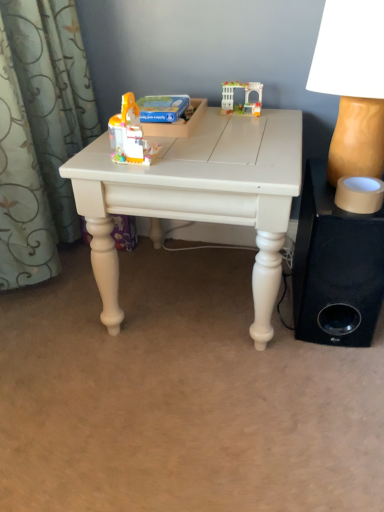
Question: In terms of height, does translucent plastic toy at center, which is counted as the 2th toy, starting from the top, look taller or shorter compared to black fabric speaker at lower right?

Choices:
 (A) short
 (B) tall

Answer: (A)

Question: From a real-world perspective, is translucent plastic toy at center, which is counted as the 2th toy, starting from the top, physically located above or below black fabric speaker at lower right?

Choices:
 (A) below
 (B) above

Answer: (B)

Question: Based on their relative distances, which object is farther from the matte beige lampshade at right?

Choices:
 (A) white matte table at center
 (B) white plastic toy at upper center, acting as the 1th toy starting from the right
 (C) translucent plastic toy at center, which is the 1th toy in left-to-right order
 (D) black fabric speaker at lower right

Answer: (C)

Question: Estimate the real-world distances between objects in this image. Which object is closer to the white plastic toy at upper center, arranged as the 1th toy when viewed from the back?

Choices:
 (A) white matte table at center
 (B) translucent plastic toy at center, the 1th toy in the bottom-to-top sequence
 (C) matte beige lampshade at right
 (D) black fabric speaker at lower right

Answer: (C)